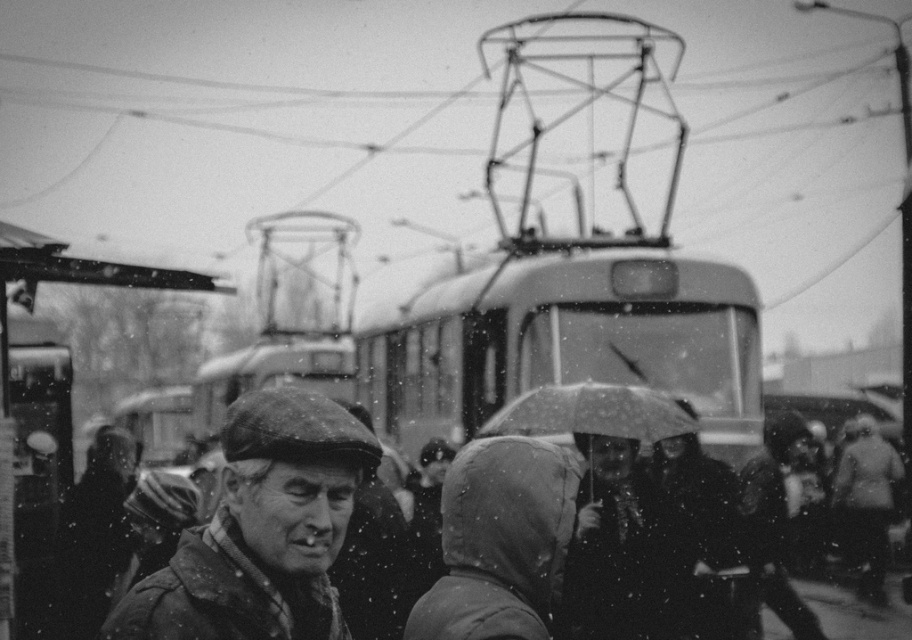
Question: Among these objects, which one is farthest from the camera?

Choices:
 (A) smooth wool cap at center
 (B) dark gray woolen hat at right
 (C) transparent plastic umbrella at center

Answer: (B)

Question: Can you confirm if dark gray fabric umbrella at center is positioned below metallic bus stop at left?

Choices:
 (A) yes
 (B) no

Answer: (A)

Question: Observing the image, what is the correct spatial positioning of transparent plastic umbrella at center in reference to coarse wool coat at right?

Choices:
 (A) below
 (B) above

Answer: (B)

Question: Which of the following is the closest to the observer?

Choices:
 (A) dark gray fabric umbrella at center
 (B) metallic bus stop at left
 (C) transparent plastic umbrella at center

Answer: (B)

Question: Which point is closer to the camera taking this photo?

Choices:
 (A) coord(9,432)
 (B) coord(696,474)
 (C) coord(309,420)

Answer: (C)

Question: From the image, what is the correct spatial relationship of smooth wool cap at center in relation to transparent plastic umbrella at center?

Choices:
 (A) below
 (B) above

Answer: (A)